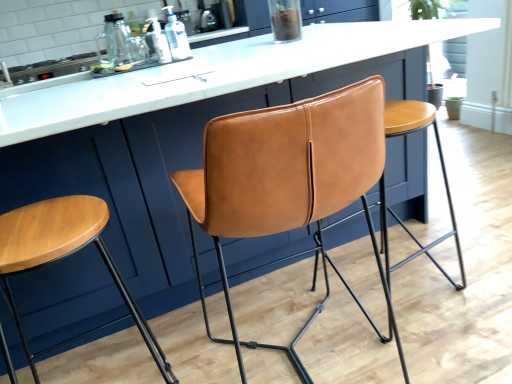
Identify the location of free point to the left of translucent plastic bottle at upper center, which is the 1th bottle in left-to-right order. pos(127,66).